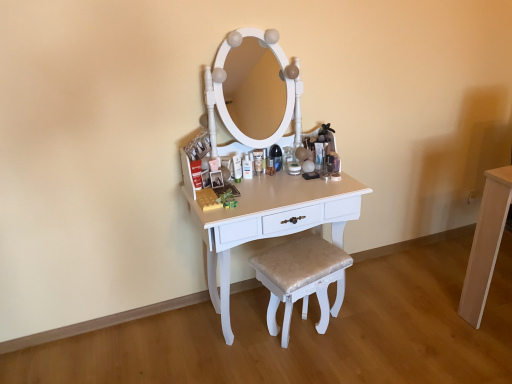
You are a GUI agent. You are given a task and a screenshot of the screen. Output one action in this format:
    pyautogui.click(x=<x>, y=<y>)
    Task: Click on the vacant area situated below light wood cabinet at right, the 2th table when ordered from left to right (from a real-world perspective)
    The width and height of the screenshot is (512, 384).
    Given the screenshot: What is the action you would take?
    pyautogui.click(x=501, y=290)